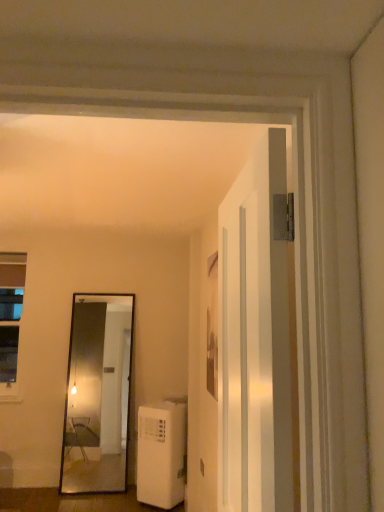
Question: Can you confirm if clear glass window at left is shorter than white glossy door at center?

Choices:
 (A) yes
 (B) no

Answer: (B)

Question: Is clear glass window at left to the right of white glossy door at center from the viewer's perspective?

Choices:
 (A) no
 (B) yes

Answer: (A)

Question: Is clear glass window at left smaller than white glossy door at center?

Choices:
 (A) yes
 (B) no

Answer: (A)

Question: Does clear glass window at left have a lesser width compared to white glossy door at center?

Choices:
 (A) yes
 (B) no

Answer: (A)

Question: Could you tell me if clear glass window at left is turned towards white glossy door at center?

Choices:
 (A) yes
 (B) no

Answer: (B)

Question: From the image's perspective, is white plastic air conditioner at lower left located above or below white glossy door at center?

Choices:
 (A) above
 (B) below

Answer: (B)

Question: Based on their sizes in the image, would you say white plastic air conditioner at lower left is bigger or smaller than white glossy door at center?

Choices:
 (A) small
 (B) big

Answer: (B)

Question: Does point (139, 496) appear closer or farther from the camera than point (221, 211)?

Choices:
 (A) closer
 (B) farther

Answer: (B)

Question: Is white plastic air conditioner at lower left wider or thinner than white glossy door at center?

Choices:
 (A) wide
 (B) thin

Answer: (A)

Question: Looking at their shapes, would you say white glossy door at center is wider or thinner than white plastic air conditioner at lower left?

Choices:
 (A) wide
 (B) thin

Answer: (B)

Question: Considering the positions of white glossy door at center and white plastic air conditioner at lower left in the image, is white glossy door at center taller or shorter than white plastic air conditioner at lower left?

Choices:
 (A) short
 (B) tall

Answer: (B)

Question: Relative to white plastic air conditioner at lower left, is white glossy door at center in front or behind?

Choices:
 (A) behind
 (B) front

Answer: (B)

Question: Choose the correct answer: Is white glossy door at center inside white plastic air conditioner at lower left or outside it?

Choices:
 (A) inside
 (B) outside

Answer: (B)

Question: In terms of height, does clear glass window at left look taller or shorter compared to white plastic air conditioner at lower left?

Choices:
 (A) short
 (B) tall

Answer: (B)

Question: Is clear glass window at left in front of or behind white plastic air conditioner at lower left in the image?

Choices:
 (A) behind
 (B) front

Answer: (A)